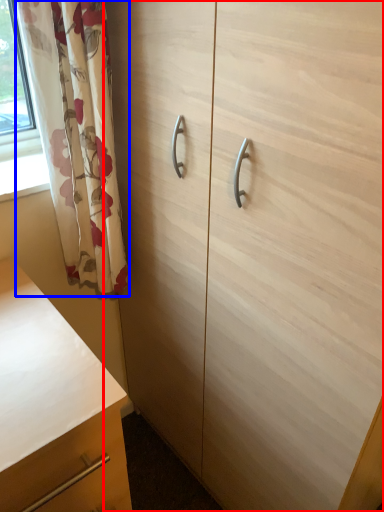
Question: Among these objects, which one is farthest to the camera, cabinetry (highlighted by a red box) or curtain (highlighted by a blue box)?

Choices:
 (A) cabinetry
 (B) curtain

Answer: (B)